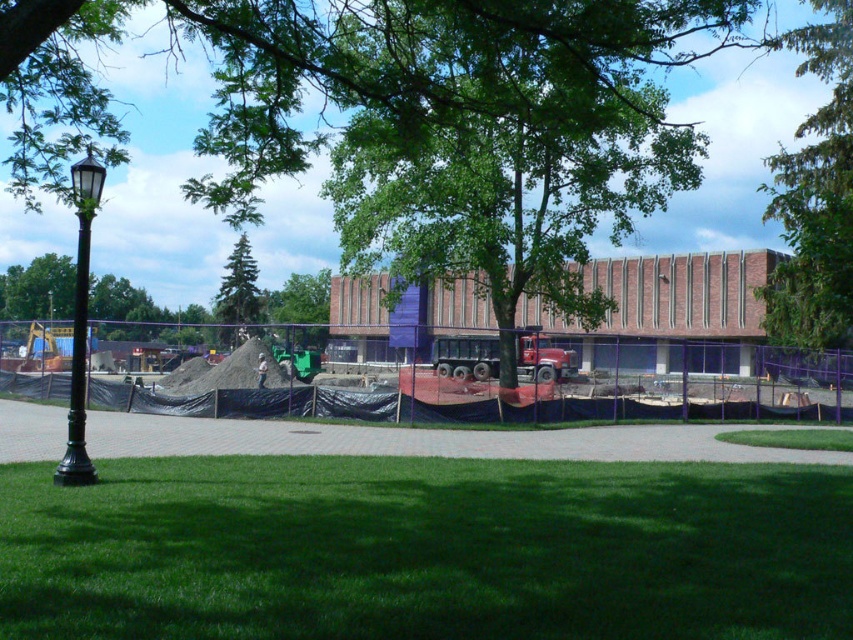
Between green grass at lower center and green coniferous tree at upper left, which one has more height?

With more height is green coniferous tree at upper left.

Which is more to the left, green grass at lower center or green coniferous tree at upper left?

From the viewer's perspective, green coniferous tree at upper left appears more on the left side.

Locate an element on the screen. The width and height of the screenshot is (853, 640). green grass at lower center is located at coordinates (426, 550).

Does black polished metal lamp post at left lie behind green leafy tree at center?

No, black polished metal lamp post at left is in front of green leafy tree at center.

Is point (84, 296) farther from viewer compared to point (306, 280)?

No, (84, 296) is closer to viewer.

Is point (88, 173) positioned after point (308, 296)?

No, (88, 173) is closer to viewer.

The height and width of the screenshot is (640, 853). Identify the location of black polished metal lamp post at left. (80, 323).

Who is shorter, black polished metal lamp post at left or green coniferous tree at upper left?

Standing shorter between the two is green coniferous tree at upper left.

Who is positioned more to the left, black polished metal lamp post at left or green coniferous tree at upper left?

green coniferous tree at upper left is more to the left.

You are a GUI agent. You are given a task and a screenshot of the screen. Output one action in this format:
    pyautogui.click(x=<x>, y=<y>)
    Task: Click on the black polished metal lamp post at left
    This screenshot has width=853, height=640.
    Given the screenshot: What is the action you would take?
    pyautogui.click(x=80, y=323)

This screenshot has width=853, height=640. What are the coordinates of `black polished metal lamp post at left` in the screenshot? It's located at (80, 323).